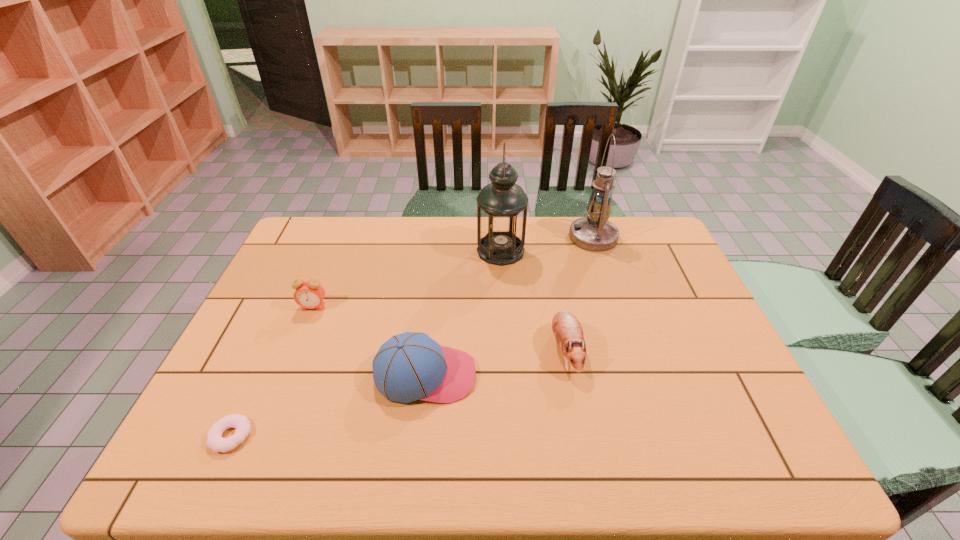
Where is `the left oil lamp`? the left oil lamp is located at coordinates click(502, 205).

You are a GUI agent. You are given a task and a screenshot of the screen. Output one action in this format:
    pyautogui.click(x=<x>, y=<y>)
    Task: Click on the rightmost object
    
    Given the screenshot: What is the action you would take?
    pyautogui.click(x=595, y=233)

I want to click on the third farthest object, so click(x=309, y=294).

Find the location of a particular element. This screenshot has width=960, height=540. baseball cap is located at coordinates (410, 366).

The image size is (960, 540). I want to click on the fifth object from left to right, so point(567,329).

Locate an element on the screen. This screenshot has width=960, height=540. the shortest object is located at coordinates coord(215,441).

The height and width of the screenshot is (540, 960). Find the location of `doughnut`. doughnut is located at coordinates (215, 441).

Locate an element on the screen. free spot located 0.110m on the back of the left oil lamp is located at coordinates (499, 219).

Identify the location of blank area located 0.120m on the front of the rightmost object. This screenshot has width=960, height=540. (606, 275).

The width and height of the screenshot is (960, 540). I want to click on vacant position located 0.080m on the face of the alarm clock, so click(303, 333).